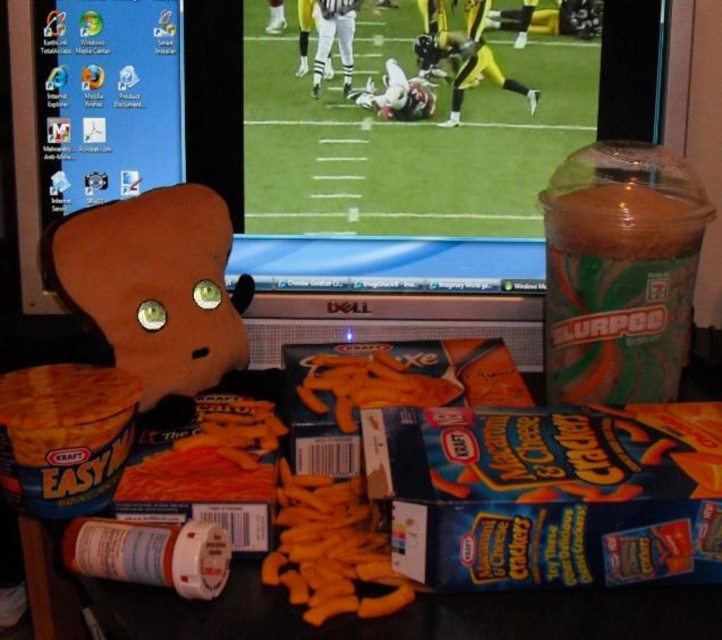
Does brown plush toy at left have a larger size compared to yellow matte macaroni at center?

Yes.

Does brown plush toy at left have a greater width compared to yellow matte macaroni at center?

Yes.

This screenshot has height=640, width=722. What do you see at coordinates (155, 285) in the screenshot?
I see `brown plush toy at left` at bounding box center [155, 285].

The height and width of the screenshot is (640, 722). What are the coordinates of `brown plush toy at left` in the screenshot? It's located at (155, 285).

Is yellow matte macaroni at center wider than orange matte macaroni at center?

Incorrect, yellow matte macaroni at center's width does not surpass orange matte macaroni at center's.

Where is `yellow matte macaroni at center`? yellow matte macaroni at center is located at coordinates (330, 548).

Find the location of a particular element. yellow matte macaroni at center is located at coordinates (330, 548).

This screenshot has width=722, height=640. I want to click on yellow matte macaroni at center, so click(330, 548).

Who is positioned more to the right, brown plush toy at left or orange matte macaroni at center?

Positioned to the right is orange matte macaroni at center.

Can you confirm if brown plush toy at left is bigger than orange matte macaroni at center?

Yes, brown plush toy at left is bigger than orange matte macaroni at center.

Where is `brown plush toy at left`? The height and width of the screenshot is (640, 722). brown plush toy at left is located at coordinates (155, 285).